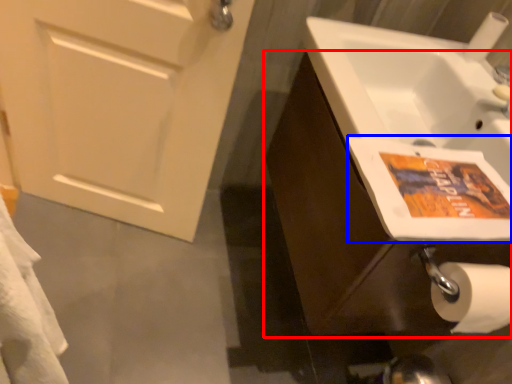
Question: Which point is further to the camera, bathroom cabinet (highlighted by a red box) or flyer (highlighted by a blue box)?

Choices:
 (A) bathroom cabinet
 (B) flyer

Answer: (A)